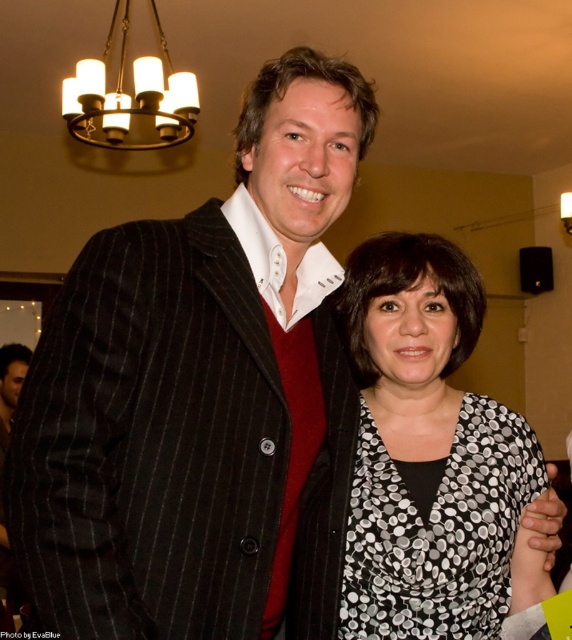
You are a photographer at this event and want to ensure both the black pinstripe suit at center and the black dotted blouse at center are clearly visible in your photo. Since they are positioned close to each other, which one is closer to the camera so that I can adjust the focus accordingly?

The black pinstripe suit at center is in front of the black dotted blouse at center, so it is closer to the camera and should be the focus point.